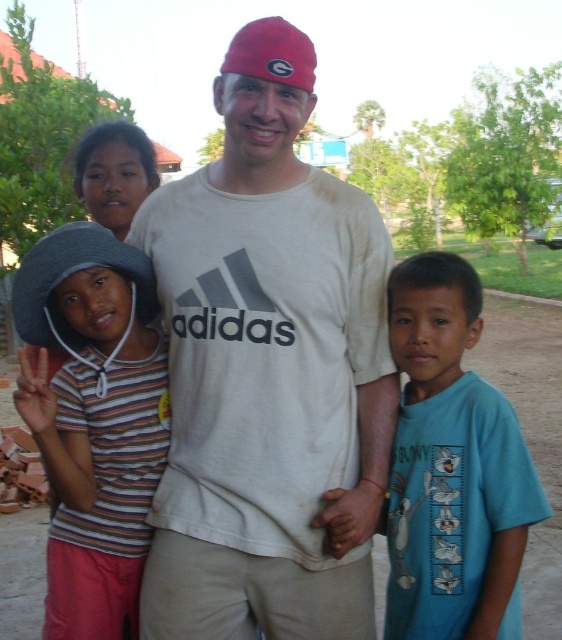
In the scene, where is the striped fabric hat at left located in terms of its 2D coordinates?

The striped fabric hat at left is located at the 2D coordinates of point (93, 419).